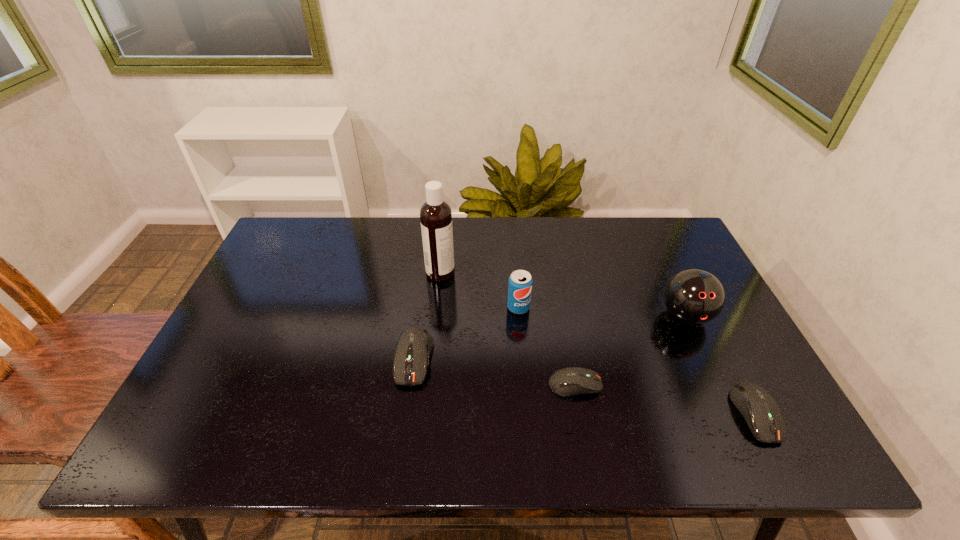
Where is `free location at the left edge`? The height and width of the screenshot is (540, 960). free location at the left edge is located at coordinates (271, 354).

In the image, there is a desktop. Identify the location of free space at the right edge. This screenshot has width=960, height=540. (660, 275).

The image size is (960, 540). I want to click on blank space at the far left corner, so click(304, 227).

The width and height of the screenshot is (960, 540). What are the coordinates of `vacant region at the near left corner` in the screenshot? It's located at (194, 410).

Find the location of a particular element. vacant space that's between the farthest object and the soda can is located at coordinates (479, 290).

Identify the location of vacant region between the shortest computer equipment and the dishwasher detergent. Image resolution: width=960 pixels, height=540 pixels. (508, 329).

Where is `unoccupied position between the shortest object and the third tallest object`? The height and width of the screenshot is (540, 960). unoccupied position between the shortest object and the third tallest object is located at coordinates pyautogui.click(x=547, y=346).

Locate an element on the screen. The image size is (960, 540). blank region between the second shortest computer equipment and the shortest object is located at coordinates (665, 399).

Where is `free area in between the bowling ball and the shortest object`? This screenshot has width=960, height=540. free area in between the bowling ball and the shortest object is located at coordinates (630, 350).

The width and height of the screenshot is (960, 540). I want to click on vacant space in between the farthest object and the third object from right to left, so click(508, 329).